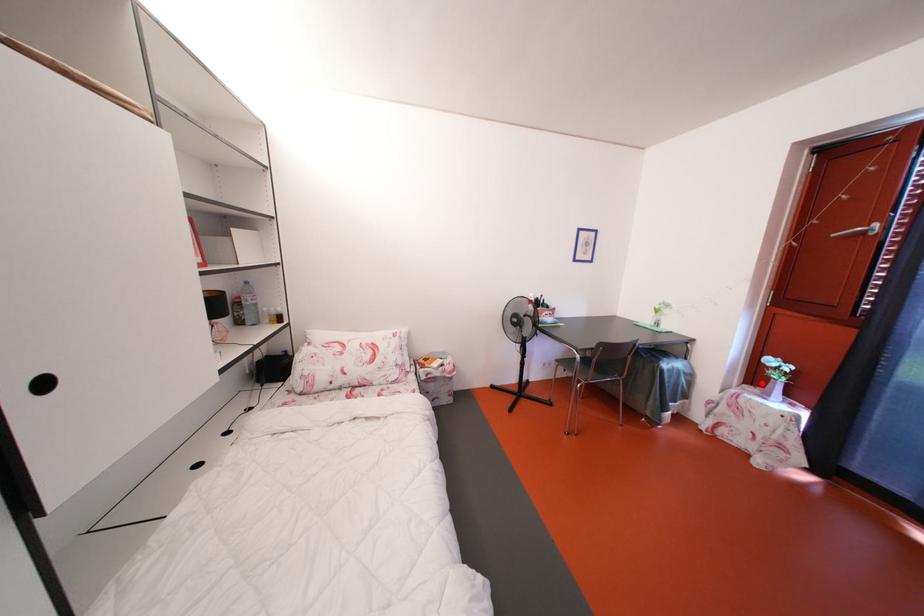
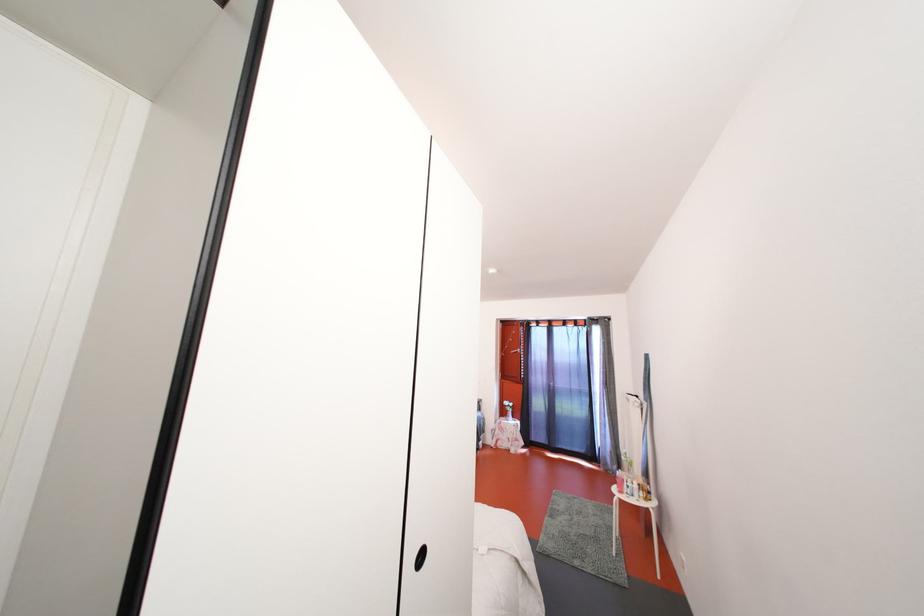
Question: I am providing you with two images of the same scene from different viewpoints. Given a red point in image1, look at the same physical point in image2. Is it:

Choices:
 (A) Closer to the viewpoint
 (B) Farther from the viewpoint

Answer: (B)